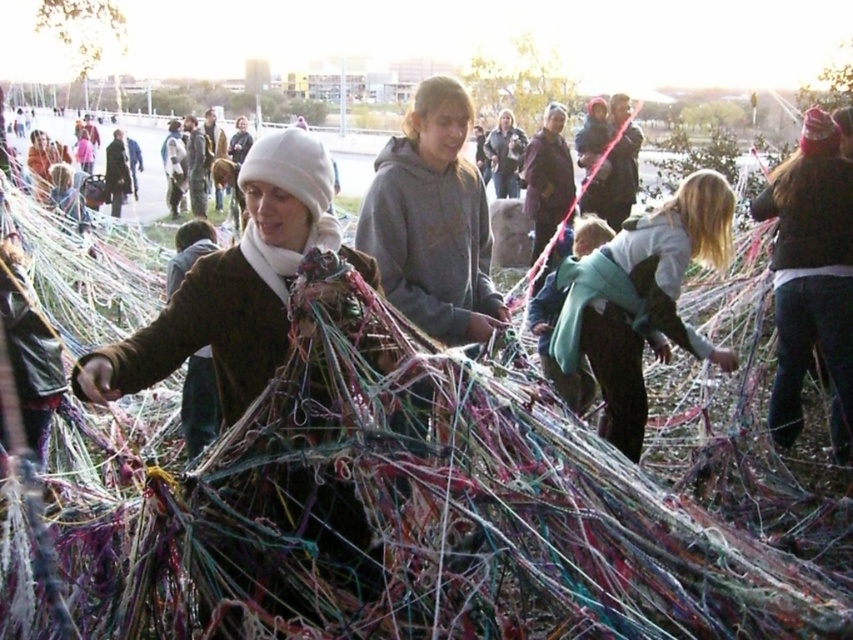
Question: Which of the following is the farthest from the observer?

Choices:
 (A) light blue fabric at center
 (B) gray hoodie at center

Answer: (A)

Question: Does gray hoodie at center have a lesser width compared to light blue fabric at center?

Choices:
 (A) yes
 (B) no

Answer: (A)

Question: Can you confirm if gray hoodie at center is positioned to the left of light blue fabric at center?

Choices:
 (A) no
 (B) yes

Answer: (B)

Question: Can you confirm if gray hoodie at center is positioned to the right of light blue fabric at center?

Choices:
 (A) yes
 (B) no

Answer: (B)